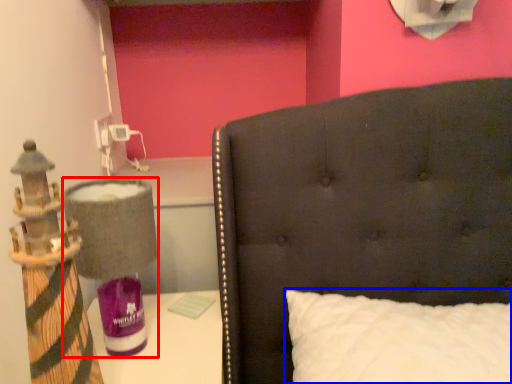
Question: Which point is closer to the camera, table lamp (highlighted by a red box) or pillow (highlighted by a blue box)?

Choices:
 (A) table lamp
 (B) pillow

Answer: (B)